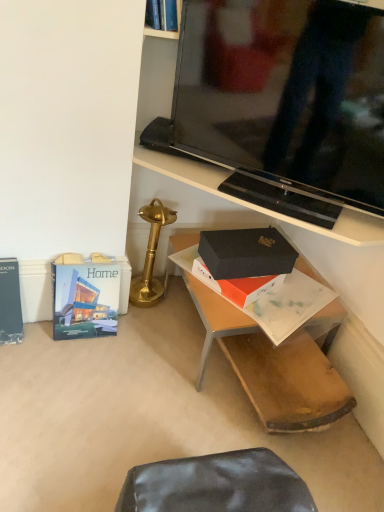
Image resolution: width=384 pixels, height=512 pixels. Find the location of `black matte box at center`. black matte box at center is located at coordinates (246, 253).

Locate an element on the screen. The width and height of the screenshot is (384, 512). black glossy tv stand at upper center is located at coordinates (291, 118).

From a real-world perspective, does black glossy tv stand at upper center stand above black matte box at center?

Yes, from a real-world perspective, black glossy tv stand at upper center is on top of black matte box at center.

Considering the positions of objects black glossy tv stand at upper center and black matte box at center in the image provided, who is more to the left, black glossy tv stand at upper center or black matte box at center?

From the viewer's perspective, black matte box at center appears more on the left side.

Are black glossy tv stand at upper center and black matte box at center located far from each other?

They are positioned close to each other.

Can you tell me how much black glossy tv stand at upper center and black matte box at center differ in facing direction?

There is a 46.7-degree angle between the facing directions of black glossy tv stand at upper center and black matte box at center.

From the image's perspective, does gold polished table lamp at center appear higher than black matte box at center?

Yes, from the image's perspective, gold polished table lamp at center is over black matte box at center.

Which of these two, gold polished table lamp at center or black matte box at center, is thinner?

gold polished table lamp at center.

Which is more to the left, gold polished table lamp at center or black matte box at center?

From the viewer's perspective, gold polished table lamp at center appears more on the left side.

Can you confirm if gold polished table lamp at center is smaller than black matte box at center?

No.

Is hardcover book at left, positioned as the second paperback book in right-to-left order, wider or thinner than black matte box at center?

Clearly, hardcover book at left, positioned as the second paperback book in right-to-left order, has less width compared to black matte box at center.

From the image's perspective, is hardcover book at left, positioned as the second paperback book in right-to-left order, above or below black matte box at center?

Clearly, from the image's perspective, hardcover book at left, positioned as the second paperback book in right-to-left order, is above black matte box at center.

Can you tell me how much hardcover book at left, acting as the first paperback book starting from the left, and black matte box at center differ in facing direction?

The angle between the facing direction of hardcover book at left, acting as the first paperback book starting from the left, and the facing direction of black matte box at center is 1.32 degrees.

Who is more distant, hardcover book at left, positioned as the second paperback book in right-to-left order, or black matte box at center?

hardcover book at left, positioned as the second paperback book in right-to-left order.

Could you tell me if black glossy tv stand at upper center is turned towards gold polished table lamp at center?

No.

From the picture: Which object is positioned more to the right, black glossy tv stand at upper center or gold polished table lamp at center?

Positioned to the right is black glossy tv stand at upper center.

Who is shorter, black glossy tv stand at upper center or gold polished table lamp at center?

gold polished table lamp at center.

How many degrees apart are the facing directions of black glossy tv stand at upper center and gold polished table lamp at center?

41.4 degrees separate the facing orientations of black glossy tv stand at upper center and gold polished table lamp at center.

From a real-world perspective, is black matte box at center positioned above or below black glossy tv stand at upper center?

From a real-world perspective, black matte box at center is physically below black glossy tv stand at upper center.

Between black matte box at center and black glossy tv stand at upper center, which one has larger size?

With larger size is black matte box at center.

Considering the positions of points (342, 308) and (334, 189), is point (342, 308) closer to camera compared to point (334, 189)?

That is False.

Which point is more forward, (x=220, y=232) or (x=148, y=294)?

Point (x=220, y=232)

Is black matte box at center directly adjacent to gold polished table lamp at center?

No.

Could you tell me if black matte box at center is facing gold polished table lamp at center?

No, black matte box at center does not turn towards gold polished table lamp at center.

Looking at this image, from the image's perspective, is black matte box at center above gold polished table lamp at center?

Actually, black matte box at center appears below gold polished table lamp at center in the image.

Identify the location of desk that appears above the hardcover book at lower left, which ranks as the second paperback book in left-to-right order (from a real-world perspective). (276, 364).

Is point (63, 302) more distant than point (189, 234)?

That is False.

Are hardcover book at lower left, which ranks as the second paperback book in left-to-right order, and black matte box at center located far from each other?

No.

From a real-world perspective, is hardcover book at lower left, which appears as the 1th paperback book when viewed from the right, physically located above or below black matte box at center?

hardcover book at lower left, which appears as the 1th paperback book when viewed from the right, is situated lower than black matte box at center in the real world.

Where is `desk behind the black glossy tv stand at upper center`? The width and height of the screenshot is (384, 512). desk behind the black glossy tv stand at upper center is located at coordinates (276, 364).

At what (x,y) coordinates should I click in order to perform the action: click on box below the gold polished table lamp at center (from the image's perspective). Please return your answer as a coordinate pair (x, y). This screenshot has width=384, height=512. Looking at the image, I should click on pos(246,253).

Looking at the image, which one is located further to gold polished table lamp at center, black matte box at center or hardcover book at left, acting as the first paperback book starting from the left?

hardcover book at left, acting as the first paperback book starting from the left, lies further to gold polished table lamp at center than the other object.

Considering their positions, is black glossy tv stand at upper center positioned closer to black matte box at center than hardcover book at lower left, which ranks as the second paperback book in left-to-right order?

black glossy tv stand at upper center is positioned closer to the anchor black matte box at center.

Which object lies further to the anchor point black matte box at center, hardcover book at left, positioned as the second paperback book in right-to-left order, or hardcover book at lower left, which appears as the 1th paperback book when viewed from the right?

hardcover book at left, positioned as the second paperback book in right-to-left order.

Estimate the real-world distances between objects in this image. Which object is closer to black glossy tv stand at upper center, gold polished table lamp at center or black matte box at center?

black matte box at center lies closer to black glossy tv stand at upper center than the other object.

Estimate the real-world distances between objects in this image. Which object is further from hardcover book at lower left, which appears as the 1th paperback book when viewed from the right, black glossy tv stand at upper center or hardcover book at left, positioned as the second paperback book in right-to-left order?

The object further to hardcover book at lower left, which appears as the 1th paperback book when viewed from the right, is black glossy tv stand at upper center.

Estimate the real-world distances between objects in this image. Which object is closer to black matte box at center, black matte box at center or hardcover book at lower left, which ranks as the second paperback book in left-to-right order?

black matte box at center.

Which object lies further to the anchor point black glossy tv stand at upper center, hardcover book at left, positioned as the second paperback book in right-to-left order, or hardcover book at lower left, which ranks as the second paperback book in left-to-right order?

Based on the image, hardcover book at left, positioned as the second paperback book in right-to-left order, appears to be further to black glossy tv stand at upper center.

Estimate the real-world distances between objects in this image. Which object is further from black matte box at center, hardcover book at left, acting as the first paperback book starting from the left, or hardcover book at lower left, which ranks as the second paperback book in left-to-right order?

Among the two, hardcover book at left, acting as the first paperback book starting from the left, is located further to black matte box at center.

The width and height of the screenshot is (384, 512). What are the coordinates of `box between black glossy tv stand at upper center and black matte box at center in the up-down direction` in the screenshot? It's located at (246, 253).

Find the location of a particular element. The width and height of the screenshot is (384, 512). table lamp between hardcover book at left, acting as the first paperback book starting from the left, and black matte box at center, in the horizontal direction is located at coordinates (x=151, y=256).

The height and width of the screenshot is (512, 384). I want to click on desk between gold polished table lamp at center and black matte box at center from left to right, so click(276, 364).

You are a GUI agent. You are given a task and a screenshot of the screen. Output one action in this format:
    pyautogui.click(x=<x>, y=<y>)
    Task: Click on the paperback book between hardcover book at left, acting as the first paperback book starting from the left, and gold polished table lamp at center from left to right
    This screenshot has height=512, width=384.
    Given the screenshot: What is the action you would take?
    coord(85,297)